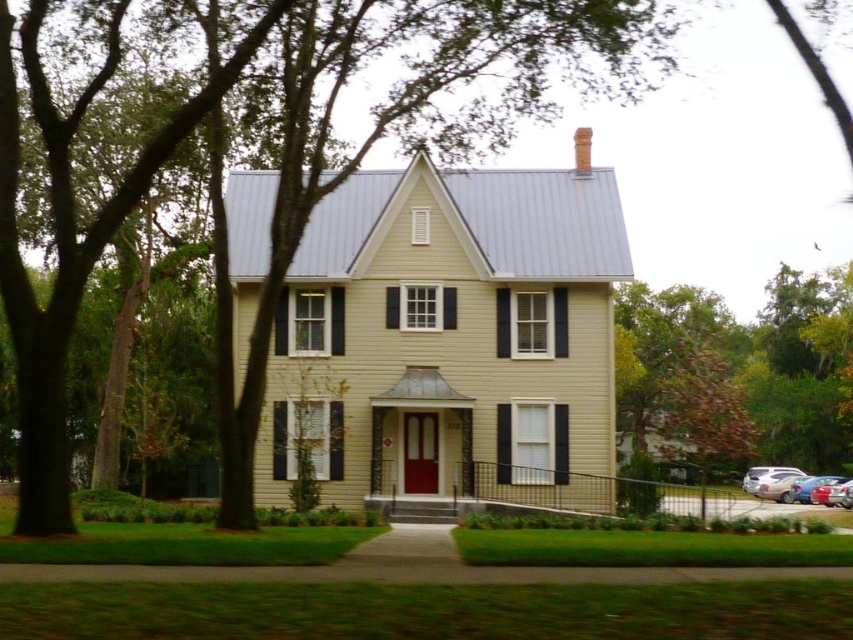
You are a delivery person approaching the house and need to park your vehicle without blocking the driveway. The driveway is located behind the metallic silver sedan at lower right. Can you drive around the green leafy tree at center to access the driveway?

The green leafy tree at center is positioned over the metallic silver sedan at lower right, which means the tree is directly above the sedan. This suggests the driveway is blocked by the tree, so you cannot drive around it to access the driveway.

You are a delivery person with a package that requires a 6 feet distance between vehicles for safe unloading. You see a metallic silver sedan at lower right and a metallic red sedan at lower right. Can you unload the package safely between them?

The metallic silver sedan at lower right is 5.38 feet from metallic red sedan at lower right. Since the required distance is 6 feet, the distance between them is insufficient for safe unloading.

You are standing in front of the house and want to park your car, which is 1.8 meters tall, in the driveway. The driveway is located between the green leafy tree at center and the metallic red sedan at lower right. Can your car fit vertically between them without hitting the tree?

The green leafy tree at center has a greater height compared to the metallic red sedan at lower right. Since the tree is taller than the sedan, the vertical space between them would be determined by the sedan. However, the sedan itself is shorter than the tree, but the question is about the vertical clearance for the car. Wait, the car height is 1.8 meters, but the description only mentions the height of the tree and sedan relative to each other. Without specific heights, we can infer that the sedan is the